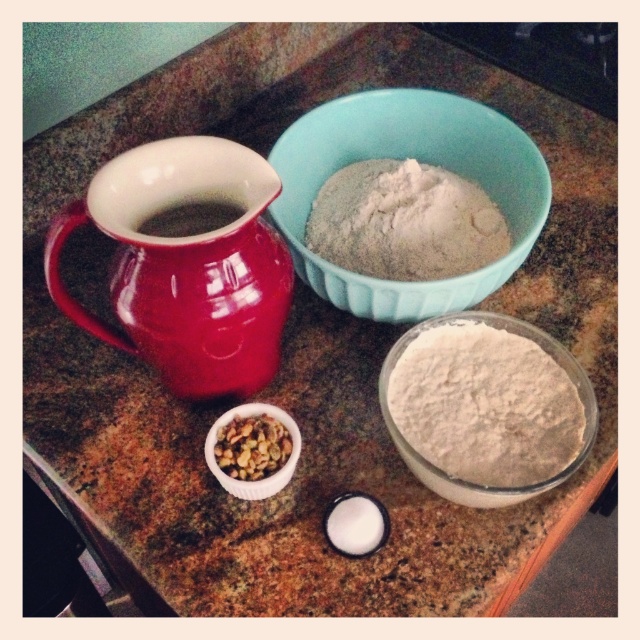
You are a baker preparing ingredients for a cake. You have a white powder at upper center and brown textured nuts at center. Which ingredient is placed above the other?

The white powder at upper center is positioned over brown textured nuts at center.

You are a baker who needs to measure the flour in the blue ceramic bowl at upper center and the brown textured nuts at center. Which container should you reach for first if you want to start with the one closer to you?

The blue ceramic bowl at upper center is closer to you, so you should reach for it first.

You are a baker preparing ingredients for a cake. You have a blue ceramic bowl at upper center and brown textured nuts at center. Which container has a greater height?

The blue ceramic bowl at upper center is taller than the brown textured nuts at center, so the blue ceramic bowl at upper center has a greater height.